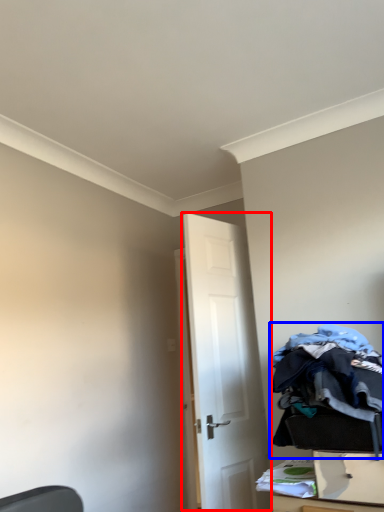
Question: Which object is further to the camera taking this photo, door (highlighted by a red box) or laundry (highlighted by a blue box)?

Choices:
 (A) door
 (B) laundry

Answer: (A)